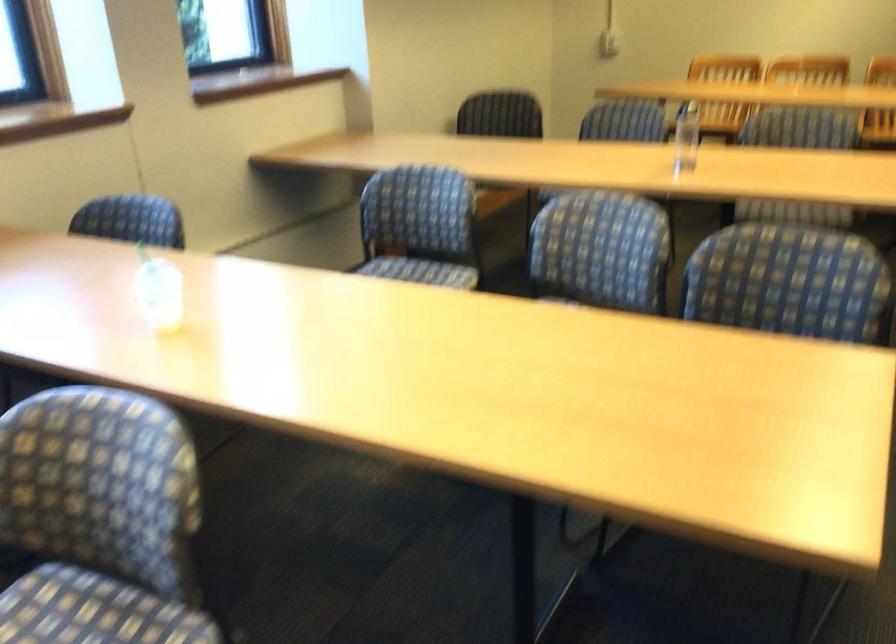
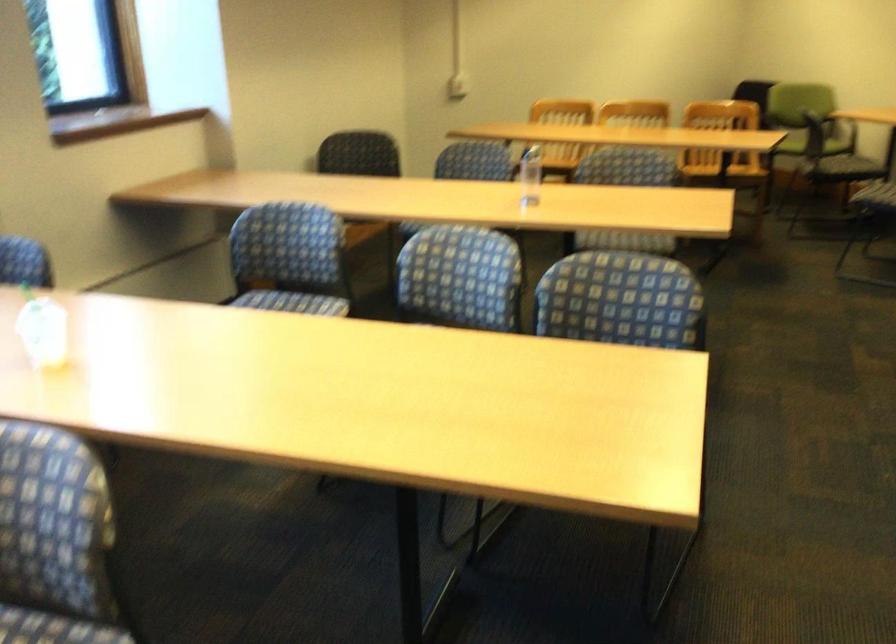
Where in the second image is the point corresponding to (x=685, y=138) from the first image?

(530, 176)